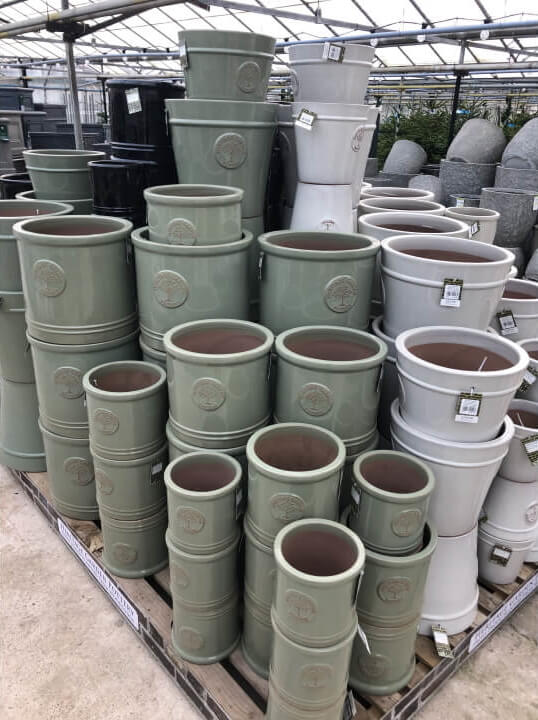
The height and width of the screenshot is (720, 538). In order to click on black pot in this screenshot , I will do `click(138, 126)`.